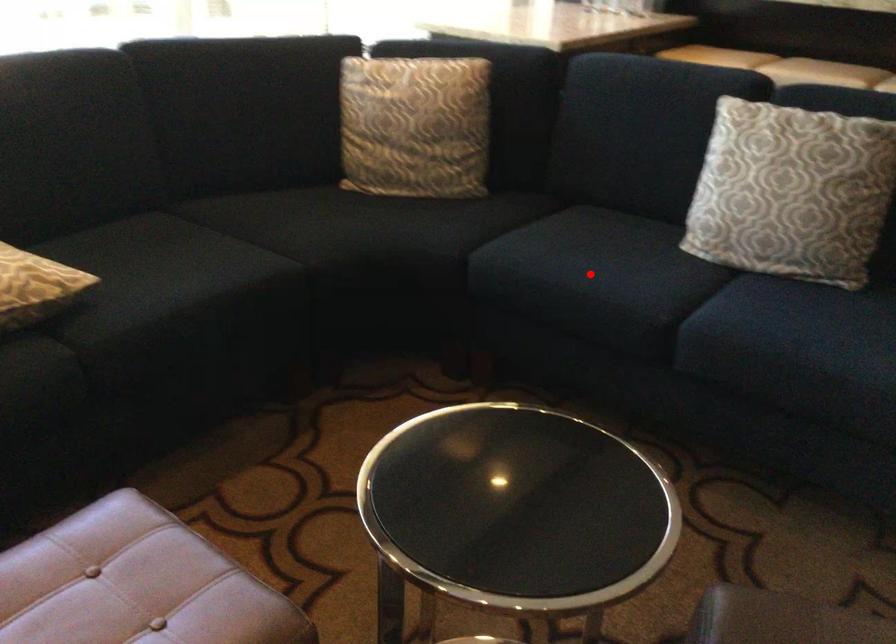
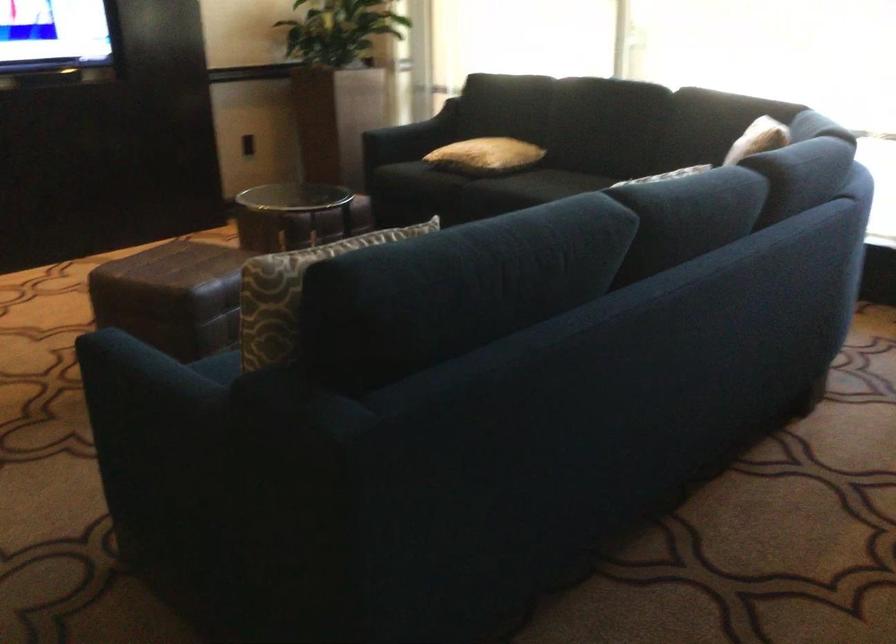
Question: I am providing you with two images of the same scene from different viewpoints. A red point is marked on the first image. At the location where the point appears in image 1, is it still visible in image 2?

Choices:
 (A) Yes
 (B) No

Answer: (B)